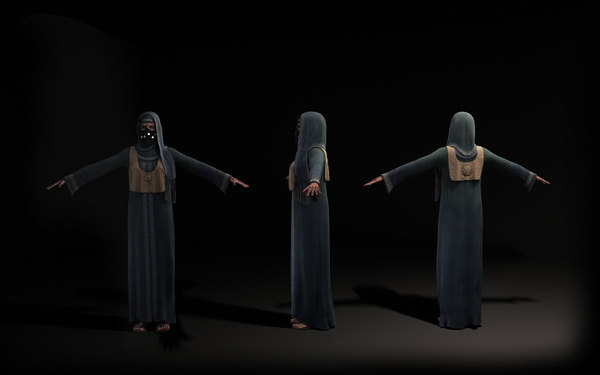
Find the location of a particular element. This screenshot has height=375, width=600. floor is located at coordinates (361, 335).